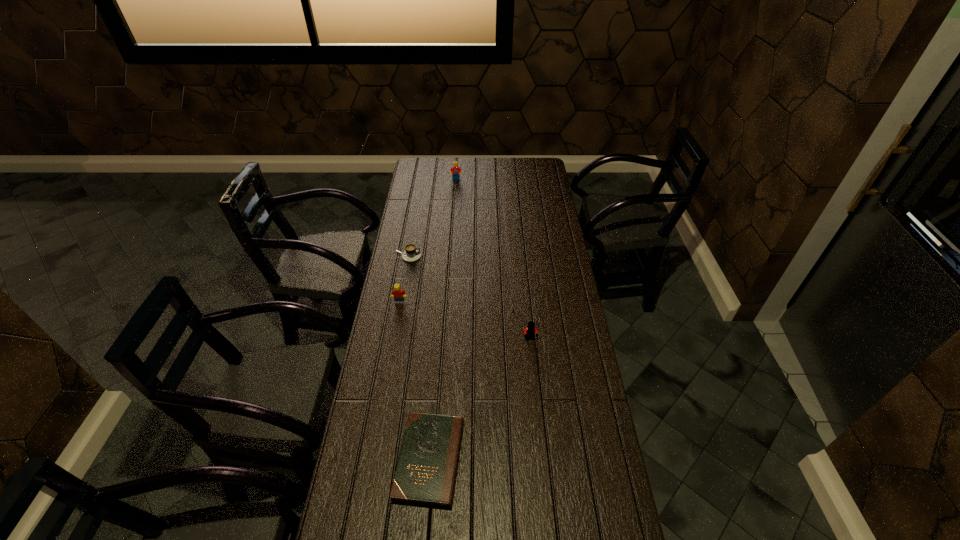
Locate an element on the screen. The height and width of the screenshot is (540, 960). the farthest Lego is located at coordinates (455, 171).

Locate an element on the screen. Image resolution: width=960 pixels, height=540 pixels. the second Lego from left to right is located at coordinates tap(455, 171).

Where is `the leftmost Lego`? The width and height of the screenshot is (960, 540). the leftmost Lego is located at coordinates (398, 294).

I want to click on the second farthest Lego, so click(398, 294).

This screenshot has width=960, height=540. Find the location of `the rightmost Lego`. the rightmost Lego is located at coordinates (529, 333).

At what (x,y) coordinates should I click in order to perform the action: click on the rightmost object. Please return your answer as a coordinate pair (x, y). This screenshot has width=960, height=540. Looking at the image, I should click on click(x=529, y=333).

This screenshot has height=540, width=960. What are the coordinates of `the fourth nearest object` in the screenshot? It's located at (412, 253).

Where is `the fourth tallest object`? the fourth tallest object is located at coordinates (412, 253).

You are a GUI agent. You are given a task and a screenshot of the screen. Output one action in this format:
    pyautogui.click(x=<x>, y=<y>)
    Task: Click on the nearest object
    
    Given the screenshot: What is the action you would take?
    pyautogui.click(x=425, y=475)

At what (x,y) coordinates should I click in order to perform the action: click on the shortest object. Please return your answer as a coordinate pair (x, y). The height and width of the screenshot is (540, 960). Looking at the image, I should click on (425, 475).